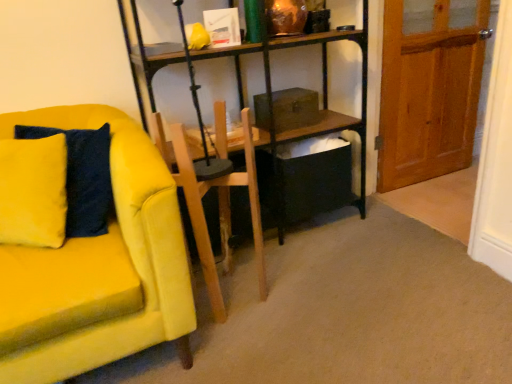
Question: Is wooden armchair at center beside velvet yellow pillow at left?

Choices:
 (A) no
 (B) yes

Answer: (A)

Question: Considering the relative sizes of wooden armchair at center and velvet yellow pillow at left in the image provided, is wooden armchair at center thinner than velvet yellow pillow at left?

Choices:
 (A) no
 (B) yes

Answer: (A)

Question: Is velvet yellow pillow at left inside wooden armchair at center?

Choices:
 (A) yes
 (B) no

Answer: (B)

Question: Is wooden armchair at center positioned behind velvet yellow pillow at left?

Choices:
 (A) yes
 (B) no

Answer: (A)

Question: Would you say wooden armchair at center is outside velvet yellow pillow at left?

Choices:
 (A) yes
 (B) no

Answer: (A)

Question: Is velvet yellow pillow at left inside or outside of velvet yellow couch at left?

Choices:
 (A) outside
 (B) inside

Answer: (B)

Question: Is velvet yellow pillow at left to the left or to the right of velvet yellow couch at left in the image?

Choices:
 (A) right
 (B) left

Answer: (B)

Question: Does point (99, 208) appear closer or farther from the camera than point (97, 359)?

Choices:
 (A) closer
 (B) farther

Answer: (B)

Question: From their relative heights in the image, would you say velvet yellow pillow at left is taller or shorter than velvet yellow couch at left?

Choices:
 (A) short
 (B) tall

Answer: (A)

Question: Is wooden at right bigger or smaller than velvet yellow couch at left?

Choices:
 (A) big
 (B) small

Answer: (B)

Question: In the image, is wooden at right on the left side or the right side of velvet yellow couch at left?

Choices:
 (A) right
 (B) left

Answer: (A)

Question: From the image's perspective, relative to velvet yellow couch at left, is wooden at right above or below?

Choices:
 (A) below
 (B) above

Answer: (B)

Question: From a real-world perspective, is wooden at right physically located above or below velvet yellow couch at left?

Choices:
 (A) above
 (B) below

Answer: (A)

Question: Considering the relative positions of wooden armchair at center and wooden at right in the image provided, is wooden armchair at center to the left or to the right of wooden at right?

Choices:
 (A) right
 (B) left

Answer: (B)

Question: Looking at their shapes, would you say wooden armchair at center is wider or thinner than wooden at right?

Choices:
 (A) thin
 (B) wide

Answer: (B)